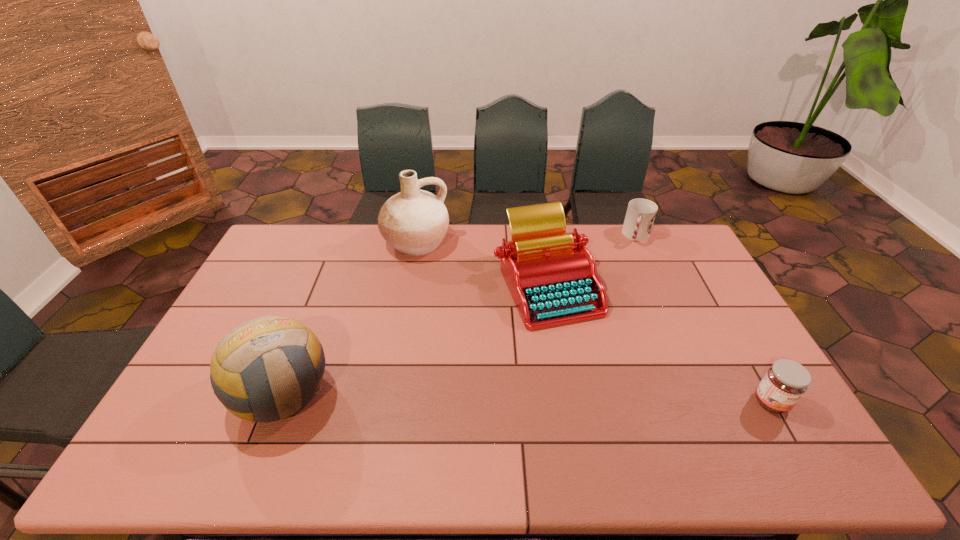
This screenshot has height=540, width=960. Identify the location of the second tallest object. (267, 369).

Identify the location of volleyball. (267, 369).

This screenshot has height=540, width=960. I want to click on jam, so click(x=785, y=382).

The width and height of the screenshot is (960, 540). Find the location of `the third object from left to right`. the third object from left to right is located at coordinates (552, 278).

This screenshot has width=960, height=540. In order to click on the third shortest object in this screenshot , I will do `click(552, 278)`.

Identify the location of the second object from right to left. (640, 215).

Identify the location of the tallest object. (414, 222).

Find the location of a particular element. The height and width of the screenshot is (540, 960). the fourth object from right to left is located at coordinates (414, 222).

I want to click on vacant area situated 0.290m on the right of the leftmost object, so click(x=441, y=394).

Where is `blank space located on the back of the rightmost object`? The image size is (960, 540). blank space located on the back of the rightmost object is located at coordinates (729, 327).